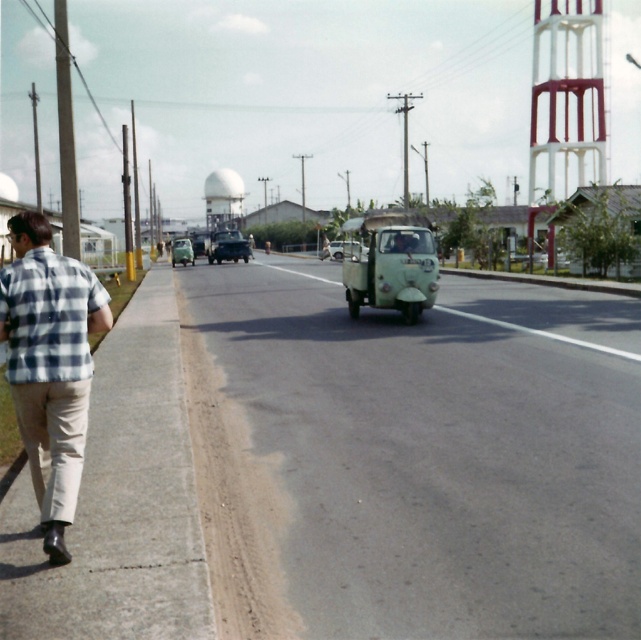
Is checkered fabric shirt at left shorter than matte green car at center?

No.

Does checkered fabric shirt at left have a greater height compared to matte green car at center?

Yes.

At what (x,y) coordinates should I click in order to perform the action: click on checkered fabric shirt at left. Please return your answer as a coordinate pair (x, y). Image resolution: width=641 pixels, height=640 pixels. Looking at the image, I should click on (47, 316).

Is point (237, 177) behind point (233, 244)?

Yes, point (237, 177) is farther from viewer.

Is white matte water tower at upper center further to the viewer compared to shiny black car at center?

Yes.

Between point (244, 188) and point (242, 253), which one is positioned in front?

Point (242, 253) is more forward.

The width and height of the screenshot is (641, 640). What are the coordinates of `white matte water tower at upper center` in the screenshot? It's located at (222, 198).

Is plaid cotton shirt at left behind white matte water tower at upper center?

No, it is in front of white matte water tower at upper center.

Is plaid cotton shirt at left taller than white matte water tower at upper center?

In fact, plaid cotton shirt at left may be shorter than white matte water tower at upper center.

Is point (19, 301) farther from camera compared to point (217, 205)?

That is False.

Image resolution: width=641 pixels, height=640 pixels. I want to click on plaid cotton shirt at left, so click(x=49, y=364).